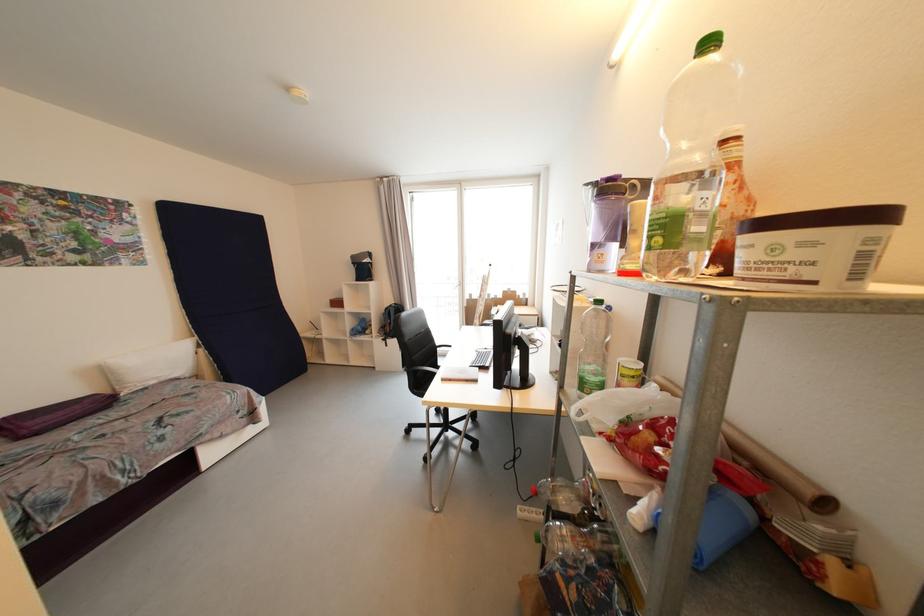
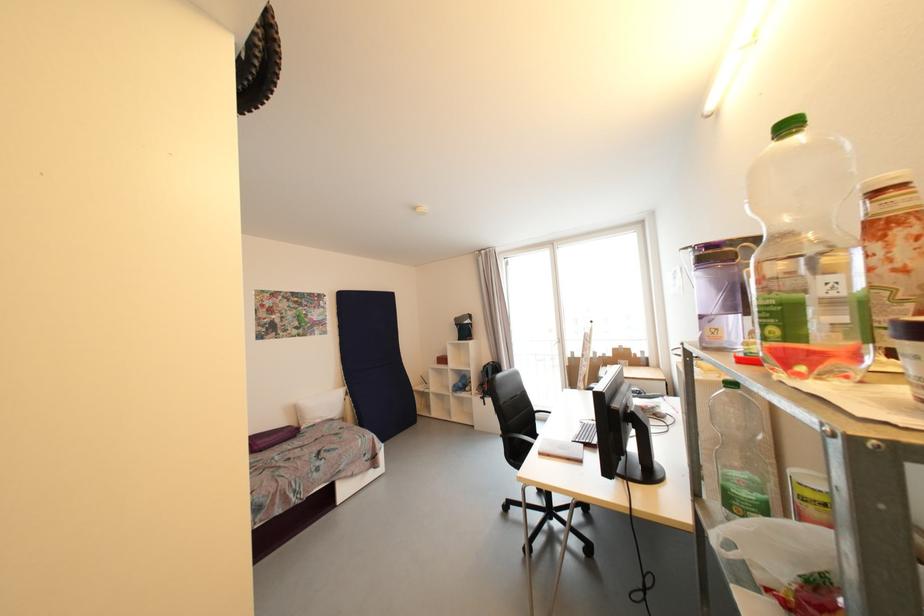
Where in the second image is the point corresponding to point (663, 241) from the first image?

(780, 331)